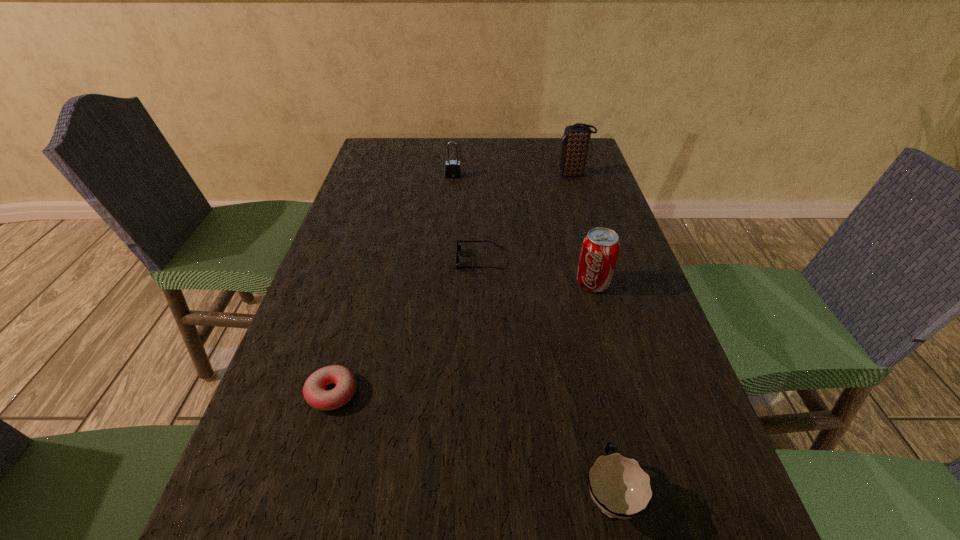
The height and width of the screenshot is (540, 960). I want to click on vacant area at the far right corner of the desktop, so click(592, 164).

You are a GUI agent. You are given a task and a screenshot of the screen. Output one action in this format:
    pyautogui.click(x=<x>, y=<y>)
    Task: Click on the free spot between the cup and the tallest object
    This screenshot has height=540, width=960.
    Given the screenshot: What is the action you would take?
    pyautogui.click(x=591, y=335)

Locate an element on the screen. The image size is (960, 540). free area in between the fourth shortest object and the fifth farthest object is located at coordinates (393, 285).

Where is `vacant area between the soda and the sunglasses`? The width and height of the screenshot is (960, 540). vacant area between the soda and the sunglasses is located at coordinates (537, 272).

Locate an element on the screen. The image size is (960, 540). vacant space that is in between the fourth shortest object and the clutch bag is located at coordinates (514, 176).

Locate an element on the screen. The height and width of the screenshot is (540, 960). free point between the soda and the padlock is located at coordinates (523, 230).

Where is `free area in between the soda and the cup`? The height and width of the screenshot is (540, 960). free area in between the soda and the cup is located at coordinates (601, 389).

The height and width of the screenshot is (540, 960). I want to click on free space between the clutch bag and the soda, so click(583, 229).

At what (x,y) coordinates should I click in order to perform the action: click on free space between the leftmost object and the tallest object. Please return your answer as a coordinate pair (x, y). The width and height of the screenshot is (960, 540). Looking at the image, I should click on (452, 284).

You are a GUI agent. You are given a task and a screenshot of the screen. Output one action in this format:
    pyautogui.click(x=<x>, y=<y>)
    Task: Click on the vacant area that lies between the fourth shortest object and the sunglasses
    The image size is (960, 540).
    Given the screenshot: What is the action you would take?
    pyautogui.click(x=467, y=218)